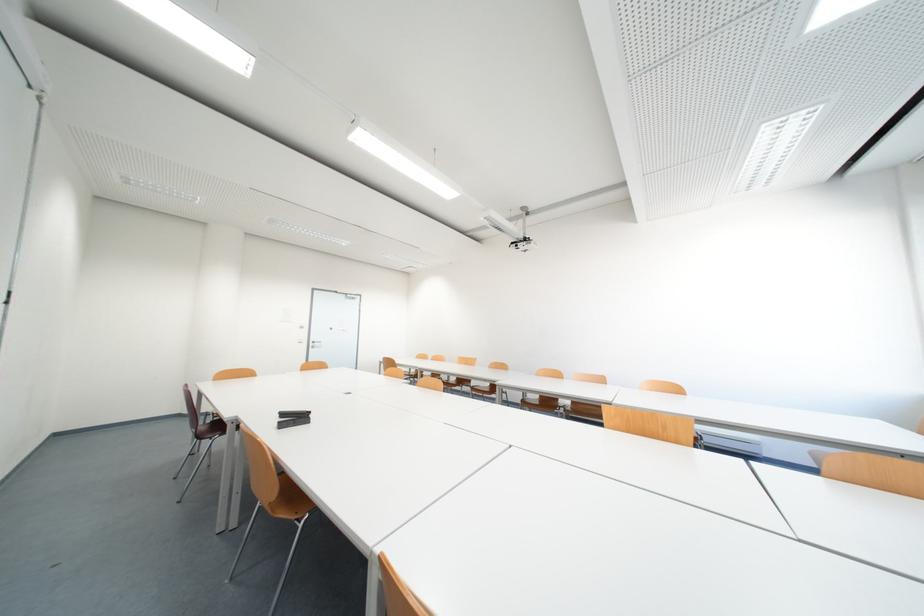
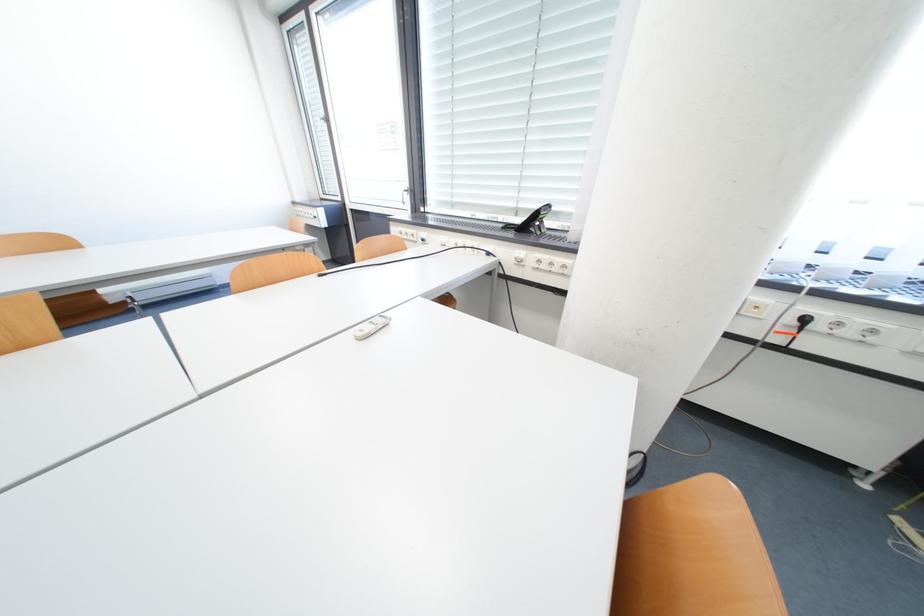
First-person continuous shooting, in which direction is the camera rotating?

The camera rotated toward right-down.